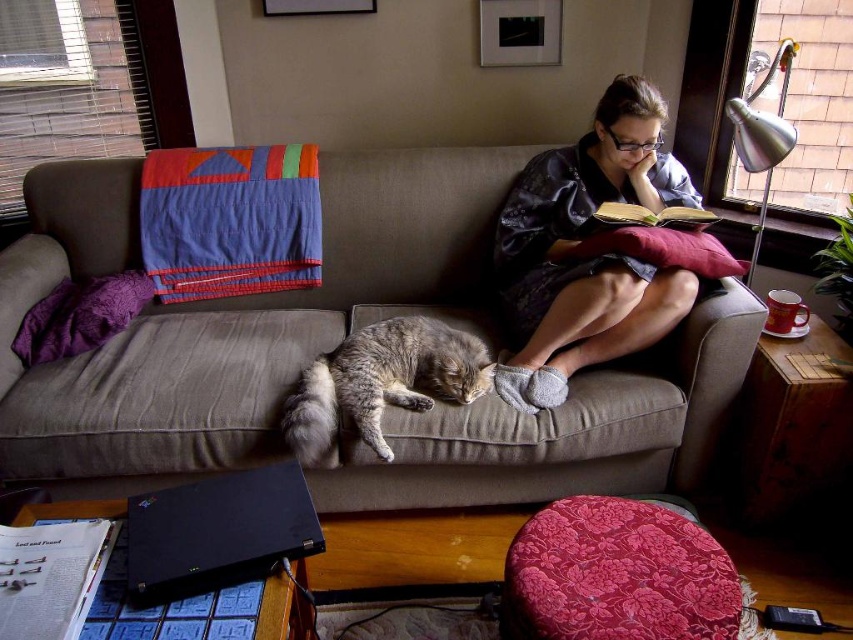
Does matte gray robe at upper right have a smaller size compared to gray striped fur cat at center?

No, matte gray robe at upper right is not smaller than gray striped fur cat at center.

Does matte gray robe at upper right have a greater width compared to gray striped fur cat at center?

Yes, matte gray robe at upper right is wider than gray striped fur cat at center.

Does point (521, 218) come closer to viewer compared to point (361, 378)?

No.

The width and height of the screenshot is (853, 640). In order to click on matte gray robe at upper right in this screenshot , I will do `click(589, 259)`.

Between point (714, 621) and point (599, 221), which one is positioned behind?

The point (599, 221) is behind.

The height and width of the screenshot is (640, 853). Identify the location of velvet floral stool at lower center. (616, 573).

Identify the location of velvet floral stool at lower center. Image resolution: width=853 pixels, height=640 pixels. (616, 573).

Measure the distance between matte gray robe at upper right and camera.

They are 5.63 feet apart.

Does matte gray robe at upper right appear on the left side of velvet floral stool at lower center?

Incorrect, matte gray robe at upper right is not on the left side of velvet floral stool at lower center.

The width and height of the screenshot is (853, 640). Describe the element at coordinates (589, 259) in the screenshot. I see `matte gray robe at upper right` at that location.

The width and height of the screenshot is (853, 640). I want to click on matte gray robe at upper right, so click(589, 259).